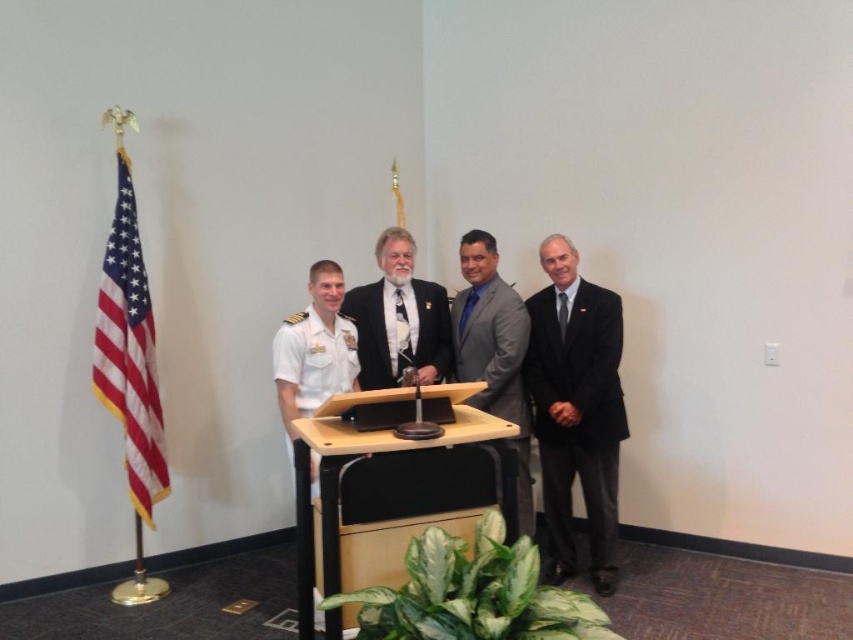
Between point (555, 465) and point (483, 365), which one is positioned behind?

The point (483, 365) is more distant.

Can you confirm if black satin business suit at right is smaller than gray matte suit at center?

Incorrect, black satin business suit at right is not smaller in size than gray matte suit at center.

Does point (538, 381) come farther from viewer compared to point (531, 524)?

No.

I want to click on black satin business suit at right, so click(577, 413).

Who is lower down, gray matte suit at center or light brown wood podium at center?

light brown wood podium at center is lower down.

Does gray matte suit at center have a larger size compared to light brown wood podium at center?

No.

The image size is (853, 640). I want to click on gray matte suit at center, so click(x=495, y=365).

Image resolution: width=853 pixels, height=640 pixels. I want to click on gray matte suit at center, so click(x=495, y=365).

Which is behind, point (610, 339) or point (160, 449)?

The point (160, 449) is behind.

Can you confirm if black satin business suit at right is positioned to the left of american flag at left?

In fact, black satin business suit at right is to the right of american flag at left.

Is point (535, 362) positioned after point (103, 321)?

Yes, point (535, 362) is farther from viewer.

This screenshot has height=640, width=853. I want to click on black satin business suit at right, so click(577, 413).